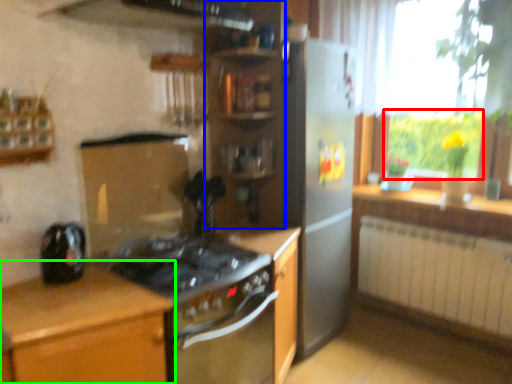
Question: Based on their relative distances, which object is farther from bright (highlighted by a red box)? Choose from shelf (highlighted by a blue box) and cabinetry (highlighted by a green box).

Choices:
 (A) shelf
 (B) cabinetry

Answer: (B)